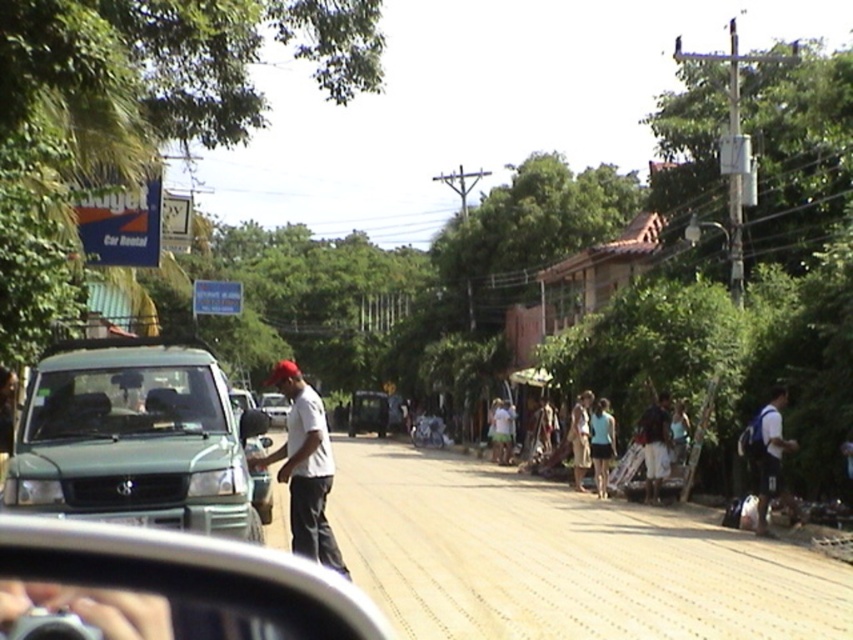
Who is more distant from viewer, (41, 380) or (282, 426)?

Positioned behind is point (282, 426).

Between transparent glass windshield at center and metallic silver car at center, which one is positioned lower?

metallic silver car at center is lower down.

Is point (173, 365) positioned after point (271, 412)?

No, it is not.

You are a GUI agent. You are given a task and a screenshot of the screen. Output one action in this format:
    pyautogui.click(x=<x>, y=<y>)
    Task: Click on the transparent glass windshield at center
    The width and height of the screenshot is (853, 640).
    Given the screenshot: What is the action you would take?
    pos(123,403)

Is point (608, 426) positioned before point (573, 468)?

That is True.

Which is more to the right, light blue fabric shorts at center-right or light brown fabric dress at center-right?

light blue fabric shorts at center-right is more to the right.

Describe the element at coordinates (601, 444) in the screenshot. Image resolution: width=853 pixels, height=640 pixels. I see `light blue fabric shorts at center-right` at that location.

Locate an element on the screen. This screenshot has width=853, height=640. light blue fabric shorts at center-right is located at coordinates (601, 444).

Can you confirm if green matte suv at center-left is positioned to the left of white matte shirt at center?

No, green matte suv at center-left is not to the left of white matte shirt at center.

Is green matte suv at center-left thinner than white matte shirt at center?

Indeed, green matte suv at center-left has a lesser width compared to white matte shirt at center.

Image resolution: width=853 pixels, height=640 pixels. In order to click on green matte suv at center-left in this screenshot , I will do `click(134, 438)`.